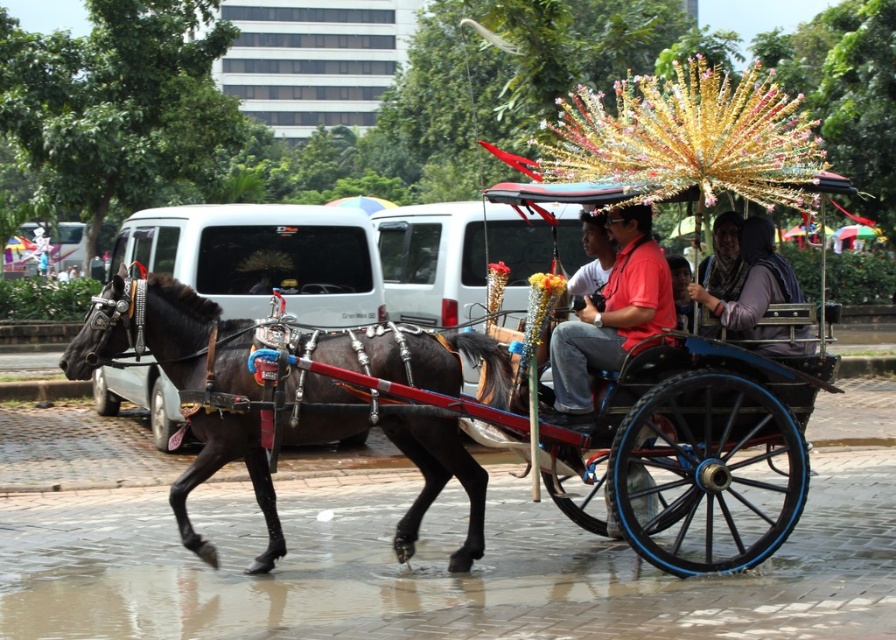
You are a photographer standing on the sidewalk, and you want to take a photo of the shiny black horse at left and the matte red shirt at center. Which object should you focus on first if you want to capture both in the same frame without moving the camera?

The shiny black horse at left is much taller than the matte red shirt at center, so you should focus on the shiny black horse at left first to ensure its full height is captured in the frame.

You are a photographer trying to capture the shiny black horse at left and the matte purple scarf at center in the same frame. Which object should you focus on first to ensure both are in the shot?

The shiny black horse at left is positioned on the left side of matte purple scarf at center. To capture both in the same frame, focus on the matte purple scarf at center first as it is centrally located, allowing the horse to be included on its left side.

You are standing on the street and see two points marked on the carriage. The first point is at position point (178, 355) and the second is at point (617, 340). From your perspective, which point is closer to you?

Point (617, 340) is closer to you because it is in front of point (178, 355).